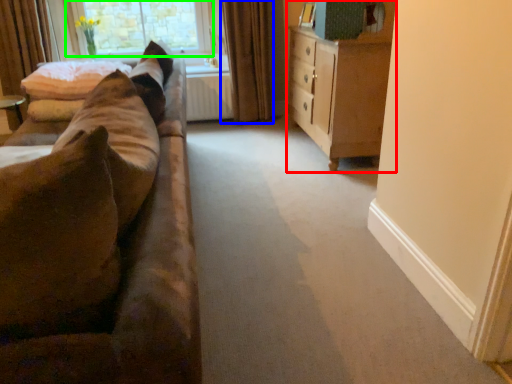
Question: Which object is positioned farthest from cabinetry (highlighted by a red box)? Select from curtain (highlighted by a blue box) and window (highlighted by a green box).

Choices:
 (A) curtain
 (B) window

Answer: (B)